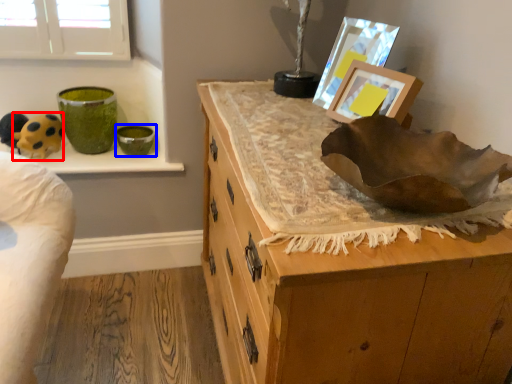
Question: Which point is further to the camera, animal (highlighted by a red box) or glass bowl (highlighted by a blue box)?

Choices:
 (A) animal
 (B) glass bowl

Answer: (B)